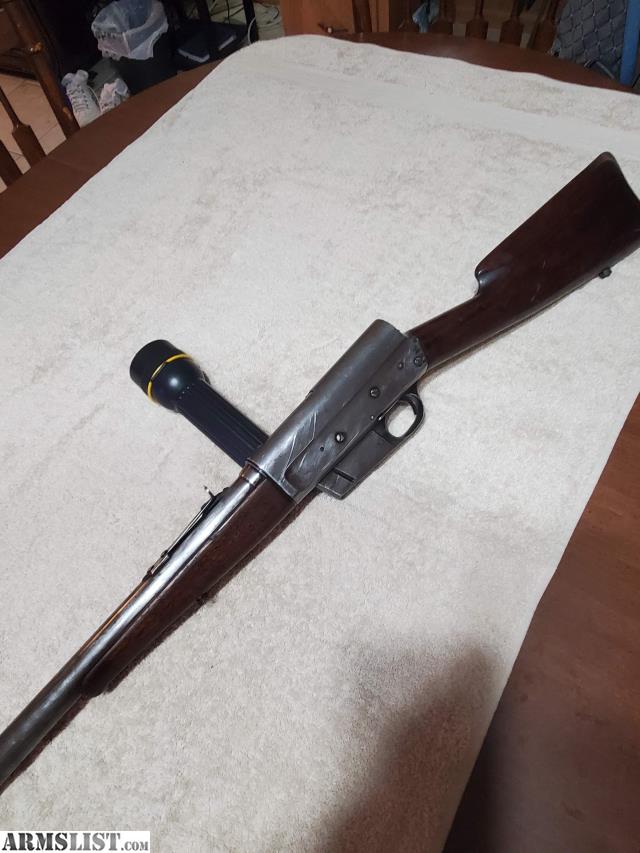
You are a GUI agent. You are given a task and a screenshot of the screen. Output one action in this format:
    pyautogui.click(x=<x>, y=<y>)
    Task: Click on the white towel
    The image size is (640, 853).
    Given the screenshot: What is the action you would take?
    pyautogui.click(x=363, y=202)